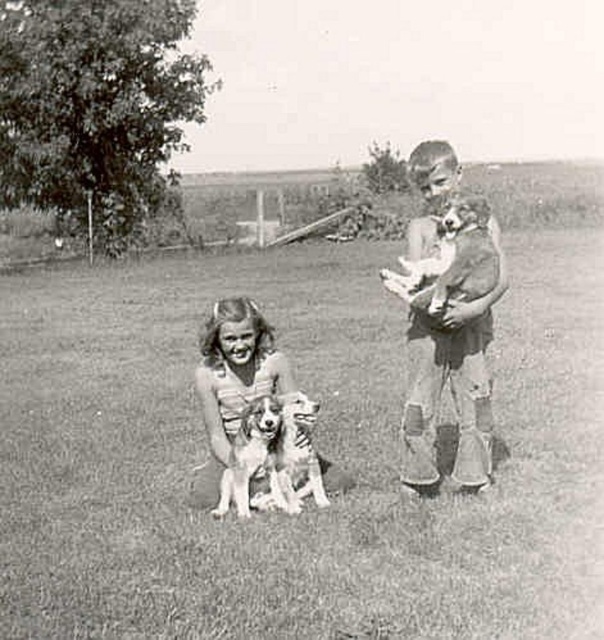
Between smooth fabric shirt at right and smooth fur dog at lower center, which one is positioned lower?

→ Positioned lower is smooth fur dog at lower center.

Is smooth fabric shirt at right further to the viewer compared to smooth fur dog at lower center?

No, smooth fabric shirt at right is closer to the viewer.

Which is in front, point (489, 454) or point (228, 406)?

Point (489, 454)

Where is `smooth fabric shirt at right`? Image resolution: width=604 pixels, height=640 pixels. smooth fabric shirt at right is located at coordinates (451, 385).

Can you confirm if smooth fur dog at lower center is positioned above soft fur dog at lower center?

Correct, smooth fur dog at lower center is located above soft fur dog at lower center.

Is smooth fur dog at lower center closer to camera compared to soft fur dog at lower center?

No.

This screenshot has width=604, height=640. What do you see at coordinates (246, 388) in the screenshot?
I see `smooth fur dog at lower center` at bounding box center [246, 388].

You are a GUI agent. You are given a task and a screenshot of the screen. Output one action in this format:
    pyautogui.click(x=<x>, y=<y>)
    Task: Click on the smooth fur dog at lower center
    Image resolution: width=604 pixels, height=640 pixels.
    Given the screenshot: What is the action you would take?
    pyautogui.click(x=246, y=388)

Is smooth fabric shirt at right bigger than soft fur dog at lower center?

No.

Which is behind, point (413, 468) or point (255, 436)?

Point (413, 468)

Is point (419, 184) in front of point (265, 456)?

No, (419, 184) is further to viewer.

Image resolution: width=604 pixels, height=640 pixels. Find the location of `smooth fabric shirt at right`. smooth fabric shirt at right is located at coordinates (451, 385).